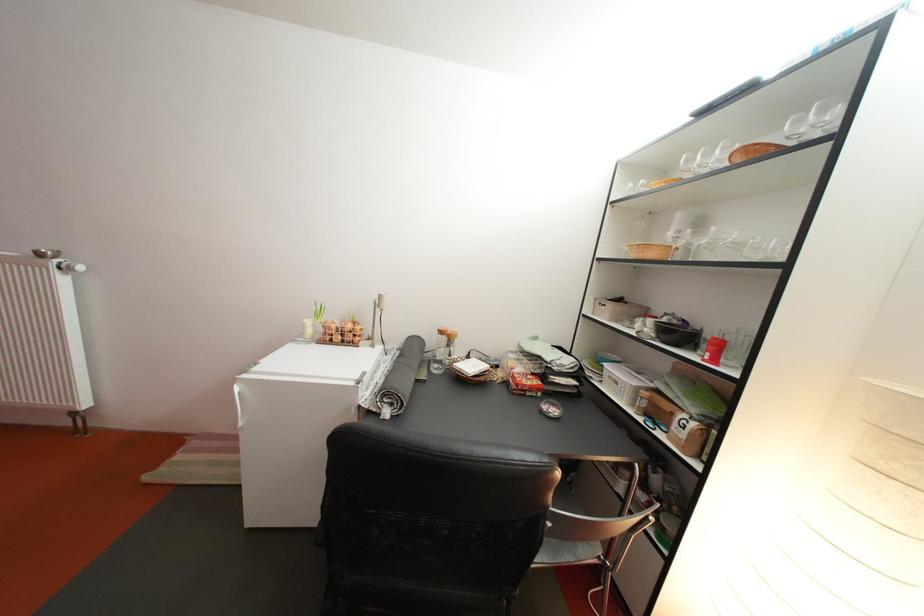
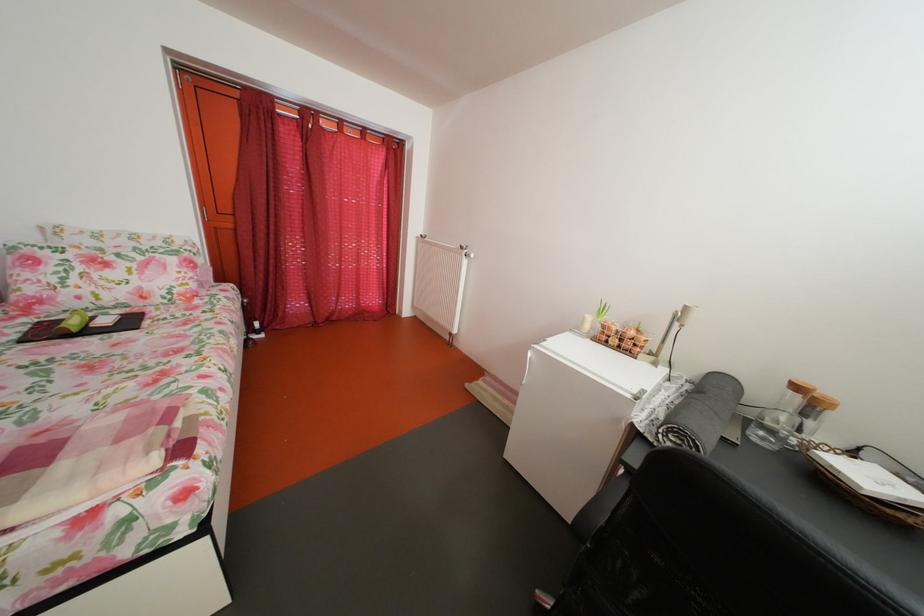
In the second image, find the point that corresponds to [462,345] in the first image.

(824, 411)